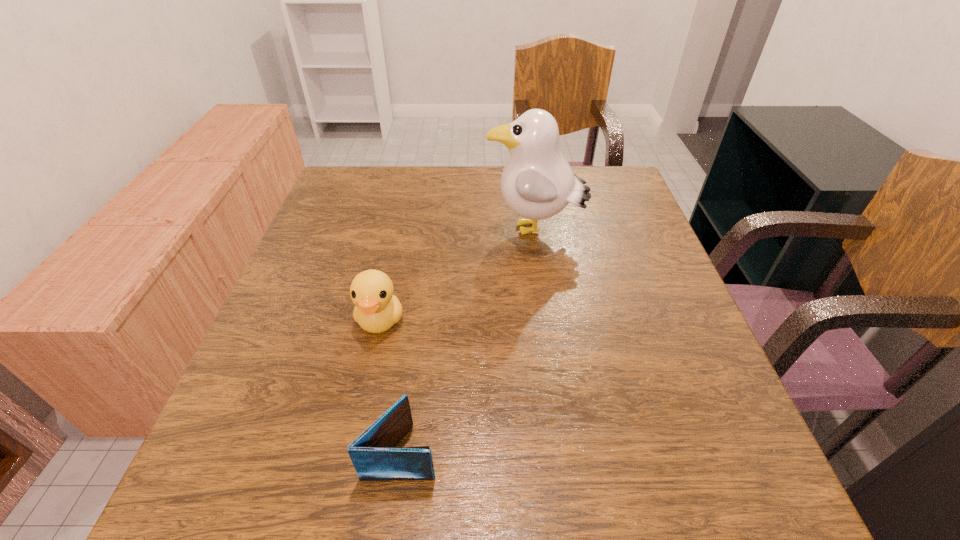
This screenshot has height=540, width=960. I want to click on vacant space located 0.150m on the exterior surface of the nearest object, so click(532, 451).

I want to click on object present at the far edge, so click(537, 182).

Find the location of a particular element. This screenshot has width=960, height=540. object that is at the near edge is located at coordinates (373, 455).

Find the location of `vacant space at the far edge of the desktop`. vacant space at the far edge of the desktop is located at coordinates (460, 180).

The width and height of the screenshot is (960, 540). I want to click on free space at the near edge, so click(422, 519).

In order to click on vacant space at the left edge of the desktop in this screenshot , I will do `click(343, 234)`.

Image resolution: width=960 pixels, height=540 pixels. I want to click on vacant space at the right edge of the desktop, so click(x=738, y=458).

In the image, there is a desktop. In order to click on vacant space at the near right corner in this screenshot , I will do `click(761, 478)`.

Image resolution: width=960 pixels, height=540 pixels. I want to click on free space between the second tallest object and the rightmost object, so click(x=457, y=275).

Where is `free space between the second shortest object and the shortest object`? The width and height of the screenshot is (960, 540). free space between the second shortest object and the shortest object is located at coordinates (391, 386).